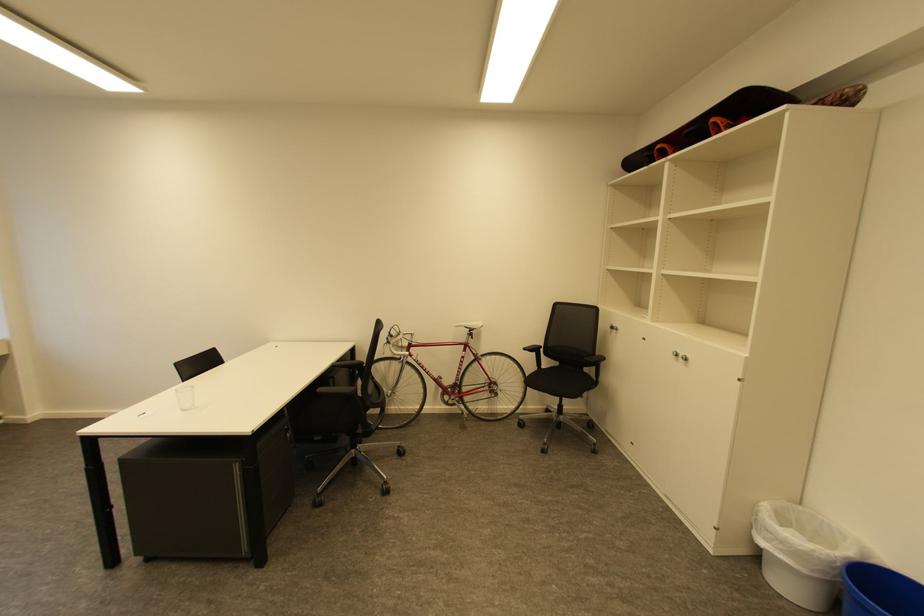
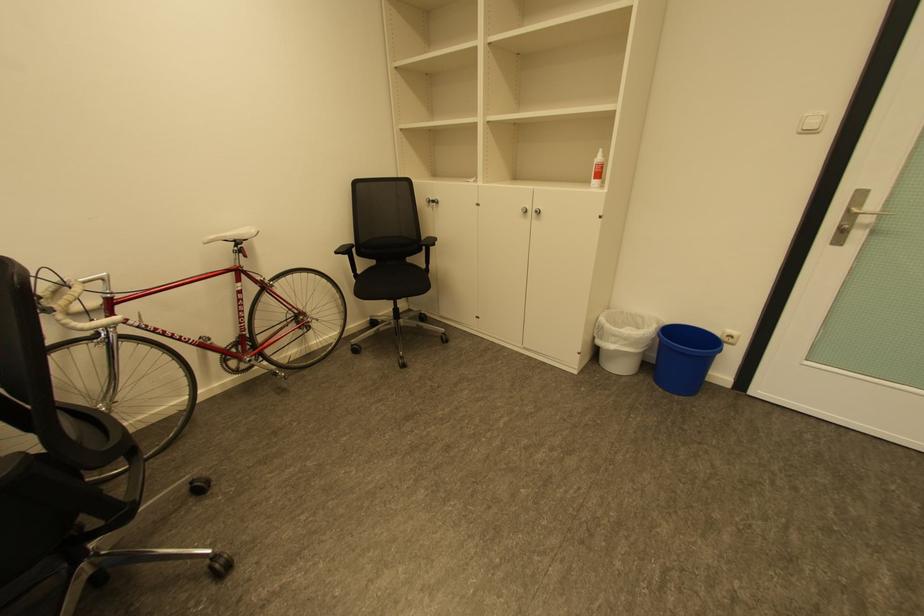
Locate, in the second image, the point that corresponds to point (597, 371) in the first image.

(426, 259)